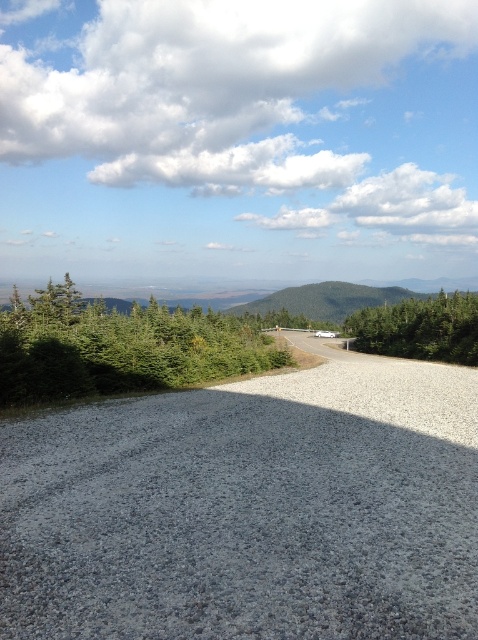
Identify the location of gray gravel road at center. (249, 508).

Does gray gravel road at center have a greater height compared to green grassy hill at center?

In fact, gray gravel road at center may be shorter than green grassy hill at center.

Does point (451, 484) lie in front of point (334, 321)?

Yes, point (451, 484) is in front of point (334, 321).

The height and width of the screenshot is (640, 478). Find the location of `gray gravel road at center`. gray gravel road at center is located at coordinates (249, 508).

At what (x,y) coordinates should I click in order to perform the action: click on green textured tree at left. Please return your answer as a coordinate pair (x, y). Looking at the image, I should click on (119, 346).

Describe the element at coordinates (119, 346) in the screenshot. I see `green textured tree at left` at that location.

Identify the location of green textured tree at left. (119, 346).

In order to click on green textured tree at left in this screenshot , I will do `click(119, 346)`.

In the scene shown: Is green textured tree at right closer to the viewer compared to green grassy hill at center?

Yes, green textured tree at right is in front of green grassy hill at center.

Is green textured tree at right below green grassy hill at center?

Yes.

You are a GUI agent. You are given a task and a screenshot of the screen. Output one action in this format:
    pyautogui.click(x=<x>, y=<y>)
    Task: Click on the green textured tree at right
    
    Given the screenshot: What is the action you would take?
    pyautogui.click(x=420, y=328)

The image size is (478, 640). Identify the location of green textured tree at right. (420, 328).